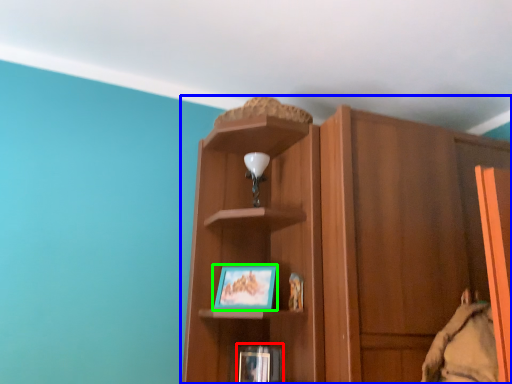
Question: Which is nearer to the book (highlighted by a red box)? cupboard (highlighted by a blue box) or picture frame (highlighted by a green box).

Choices:
 (A) cupboard
 (B) picture frame

Answer: (B)